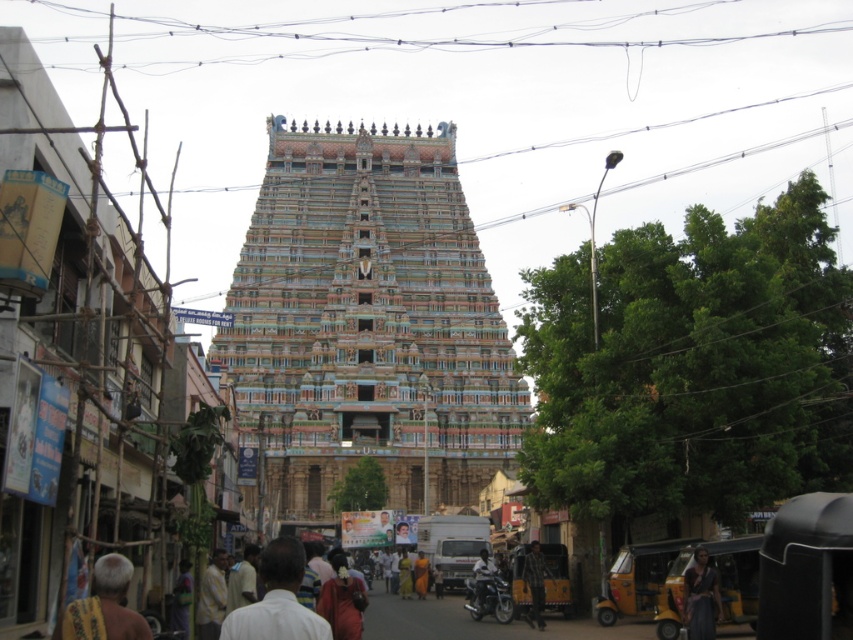
Question: Can you confirm if white matte shirt at center is positioned to the left of dark gray fabric at lower right?

Choices:
 (A) no
 (B) yes

Answer: (B)

Question: Can you confirm if multicolored painted temple at center is smaller than dark gray fabric at lower right?

Choices:
 (A) yes
 (B) no

Answer: (B)

Question: Is the position of white matte shirt at center less distant than that of dark gray fabric at lower right?

Choices:
 (A) yes
 (B) no

Answer: (A)

Question: Which point is closer to the camera?

Choices:
 (A) yellow fabric draped at lower left
 (B) multicolored painted temple at center
 (C) plaid fabric person at lower center

Answer: (A)

Question: Which of these objects is positioned closest to the yellow fabric draped at lower left?

Choices:
 (A) dark gray fabric at lower right
 (B) multicolored painted temple at center
 (C) yellow fabric shirt at lower center
 (D) plaid fabric person at lower center

Answer: (C)

Question: Which point appears farthest from the camera in this image?

Choices:
 (A) (112, 561)
 (B) (210, 563)

Answer: (B)